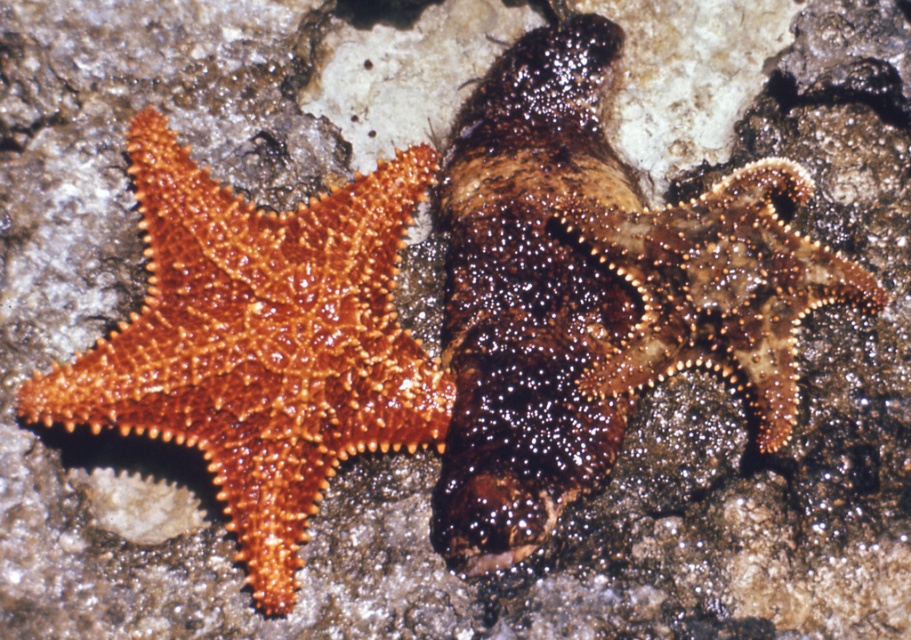
Who is shorter, shiny brown starfish at center or shiny orange starfish at left?

With less height is shiny orange starfish at left.

Describe the element at coordinates (596, 292) in the screenshot. I see `shiny brown starfish at center` at that location.

Measure the distance between shiny brown starfish at center and camera.

shiny brown starfish at center is 4.18 feet away from camera.

The image size is (911, 640). In order to click on shiny brown starfish at center in this screenshot , I will do `click(596, 292)`.

Who is higher up, shiny orange starfish at left or brown spiny starfish at center?

brown spiny starfish at center

In the scene shown: Is shiny orange starfish at left shorter than brown spiny starfish at center?

Incorrect, shiny orange starfish at left's height does not fall short of brown spiny starfish at center's.

Between point (177, 268) and point (725, 176), which one is positioned behind?

Positioned behind is point (725, 176).

This screenshot has width=911, height=640. Find the location of `shiny orange starfish at left`. shiny orange starfish at left is located at coordinates (260, 342).

Can you confirm if shiny brown starfish at center is smaller than brown spiny starfish at center?

No, shiny brown starfish at center is not smaller than brown spiny starfish at center.

I want to click on shiny brown starfish at center, so click(596, 292).